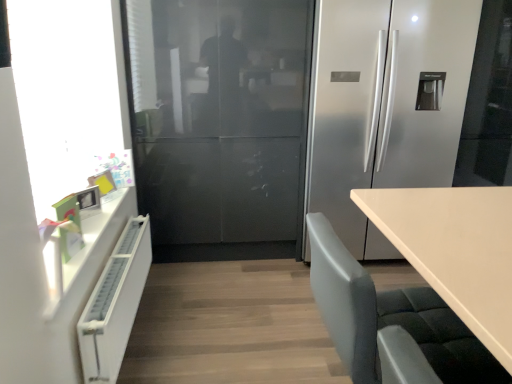
Question: From the image's perspective, is white matte radiator at left located above gray fabric chair at lower right?

Choices:
 (A) no
 (B) yes

Answer: (A)

Question: Is white matte radiator at left next to gray fabric chair at lower right and touching it?

Choices:
 (A) yes
 (B) no

Answer: (B)

Question: Are white matte radiator at left and gray fabric chair at lower right located far from each other?

Choices:
 (A) no
 (B) yes

Answer: (A)

Question: Can you confirm if white matte radiator at left is thinner than gray fabric chair at lower right?

Choices:
 (A) no
 (B) yes

Answer: (B)

Question: Is white matte radiator at left bigger than gray fabric chair at lower right?

Choices:
 (A) yes
 (B) no

Answer: (B)

Question: In the image, is gray fabric chair at lower right on the left side or the right side of transparent glass window screen at left?

Choices:
 (A) left
 (B) right

Answer: (B)

Question: In terms of width, does gray fabric chair at lower right look wider or thinner when compared to transparent glass window screen at left?

Choices:
 (A) thin
 (B) wide

Answer: (B)

Question: Considering the positions of gray fabric chair at lower right and transparent glass window screen at left in the image, is gray fabric chair at lower right taller or shorter than transparent glass window screen at left?

Choices:
 (A) short
 (B) tall

Answer: (A)

Question: Considering the positions of point (484, 375) and point (38, 185), is point (484, 375) closer or farther from the camera than point (38, 185)?

Choices:
 (A) closer
 (B) farther

Answer: (A)

Question: Considering the relative positions of gray fabric chair at lower right and white matte radiator at left in the image provided, is gray fabric chair at lower right to the left or to the right of white matte radiator at left?

Choices:
 (A) right
 (B) left

Answer: (A)

Question: Is gray fabric chair at lower right wider or thinner than white matte radiator at left?

Choices:
 (A) wide
 (B) thin

Answer: (A)

Question: From a real-world perspective, is gray fabric chair at lower right physically located above or below white matte radiator at left?

Choices:
 (A) below
 (B) above

Answer: (B)

Question: Do you think gray fabric chair at lower right is within white matte radiator at left, or outside of it?

Choices:
 (A) outside
 (B) inside

Answer: (A)

Question: From a real-world perspective, is transparent glass window screen at left above or below satin silver refrigerator at center?

Choices:
 (A) above
 (B) below

Answer: (A)

Question: Is transparent glass window screen at left in front of or behind satin silver refrigerator at center in the image?

Choices:
 (A) front
 (B) behind

Answer: (A)